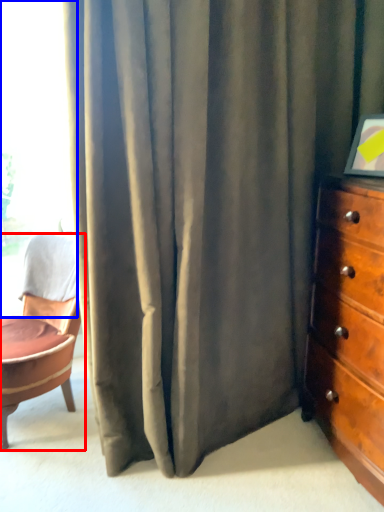
Question: Which of the following is the closest to the observer, chair (highlighted by a red box) or window (highlighted by a blue box)?

Choices:
 (A) chair
 (B) window

Answer: (A)